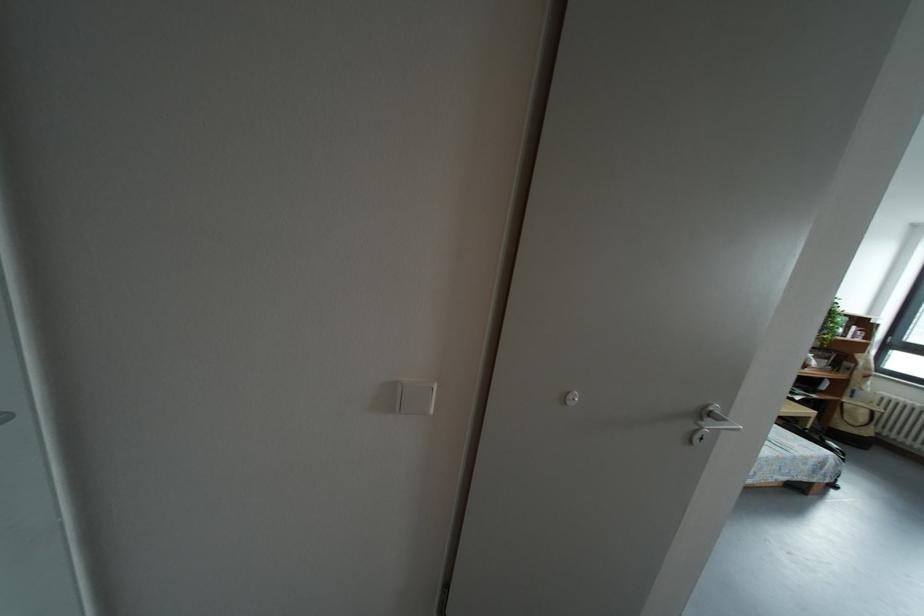
This screenshot has width=924, height=616. Find the location of `door keyhole`. door keyhole is located at coordinates (570, 398).